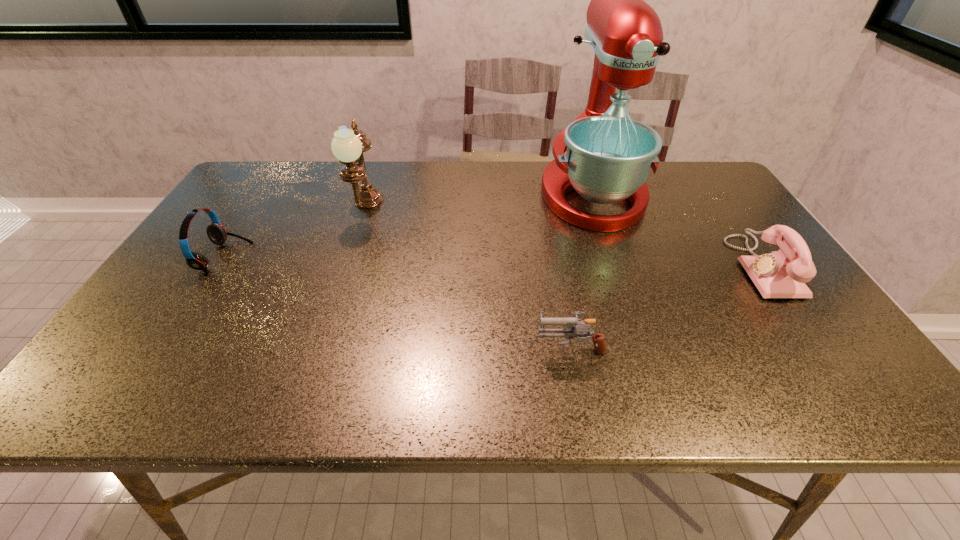
Locate an element on the screen. mixer is located at coordinates point(608,157).

The height and width of the screenshot is (540, 960). In order to click on oil lamp in this screenshot , I will do `click(348, 145)`.

This screenshot has width=960, height=540. What are the coordinates of `the fourth object from right to left` in the screenshot? It's located at (348, 145).

The image size is (960, 540). Identify the location of telephone. (781, 274).

Find the location of a particular element. The height and width of the screenshot is (540, 960). the leftmost object is located at coordinates (217, 234).

At what (x,y) coordinates should I click in order to perform the action: click on the shortest object. Please return your answer as a coordinate pair (x, y). Looking at the image, I should click on (570, 332).

Find the location of `gun`. gun is located at coordinates (570, 332).

The height and width of the screenshot is (540, 960). I want to click on blank space located 0.270m on the front-facing side of the mixer, so click(630, 305).

Locate an element on the screen. free space located 0.150m on the right of the oil lamp is located at coordinates (430, 209).

Locate an element on the screen. The height and width of the screenshot is (540, 960). free spot located 0.150m on the dial of the rightmost object is located at coordinates (681, 267).